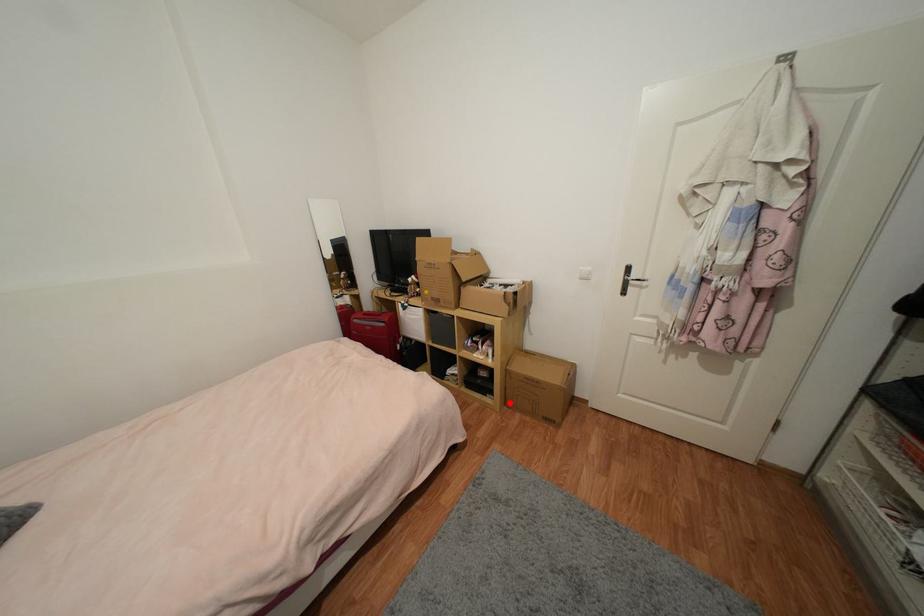
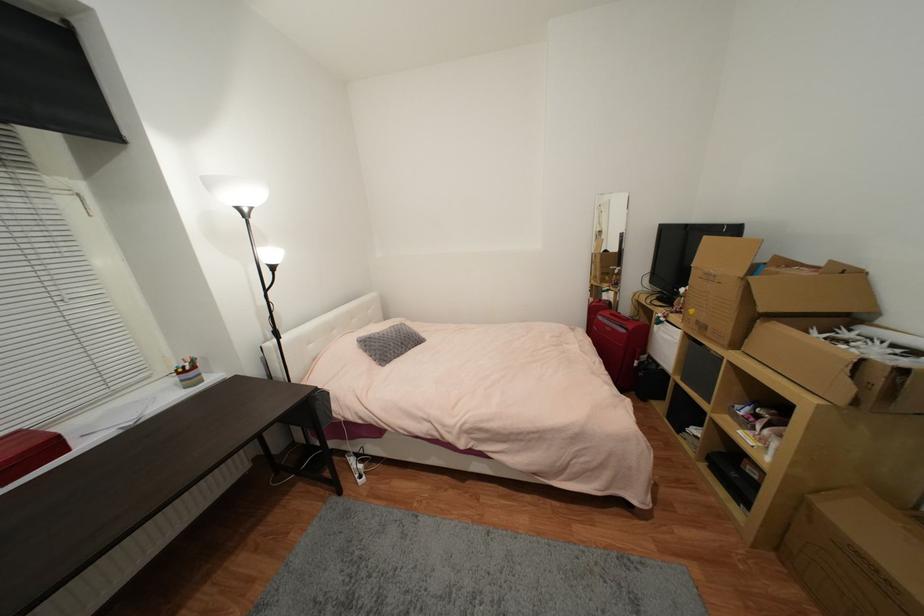
The point at the highlighted location is marked in the first image. Where is the corresponding point in the second image?

(782, 546)